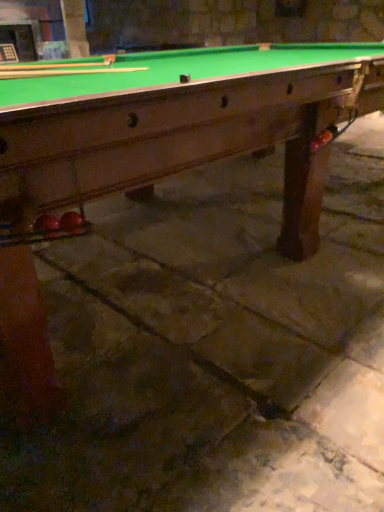
Question: Looking at the image, does wooden cue at upper left, the 2th cue when ordered from back to front, seem bigger or smaller compared to wooden cue at upper left, which is counted as the 1th cue, starting from the back?

Choices:
 (A) small
 (B) big

Answer: (B)

Question: Considering their positions, is wooden cue at upper left, the 2th cue when ordered from back to front, located in front of or behind wooden cue at upper left, which is counted as the 1th cue, starting from the back?

Choices:
 (A) behind
 (B) front

Answer: (B)

Question: In the image, is wooden cue at upper left, the 2th cue when ordered from back to front, on the left side or the right side of wooden cue at upper left, marked as the 2th cue in a front-to-back arrangement?

Choices:
 (A) right
 (B) left

Answer: (B)

Question: Looking at the image, does wooden cue at upper left, marked as the 2th cue in a front-to-back arrangement, seem bigger or smaller compared to wooden cue at upper left, the 2th cue when ordered from back to front?

Choices:
 (A) small
 (B) big

Answer: (A)

Question: Considering the positions of wooden cue at upper left, which is counted as the 1th cue, starting from the back, and wooden cue at upper left, the 2th cue when ordered from back to front, in the image, is wooden cue at upper left, which is counted as the 1th cue, starting from the back, wider or thinner than wooden cue at upper left, the 2th cue when ordered from back to front,?

Choices:
 (A) thin
 (B) wide

Answer: (B)

Question: Would you say wooden cue at upper left, which is counted as the 1th cue, starting from the back, is to the left or to the right of wooden cue at upper left, the 2th cue when ordered from back to front, in the picture?

Choices:
 (A) right
 (B) left

Answer: (A)

Question: Is point (107, 68) closer or farther from the camera than point (94, 62)?

Choices:
 (A) farther
 (B) closer

Answer: (B)